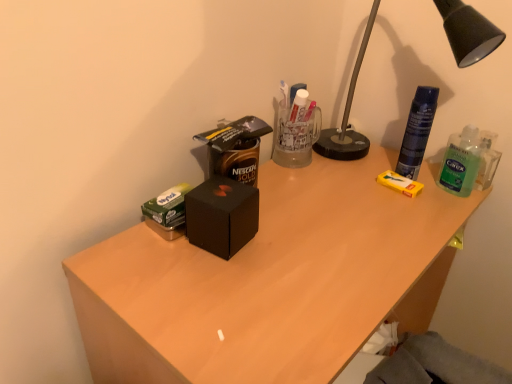
Locate an element on the screen. The image size is (512, 384). free space in front of black matte box at center is located at coordinates (227, 302).